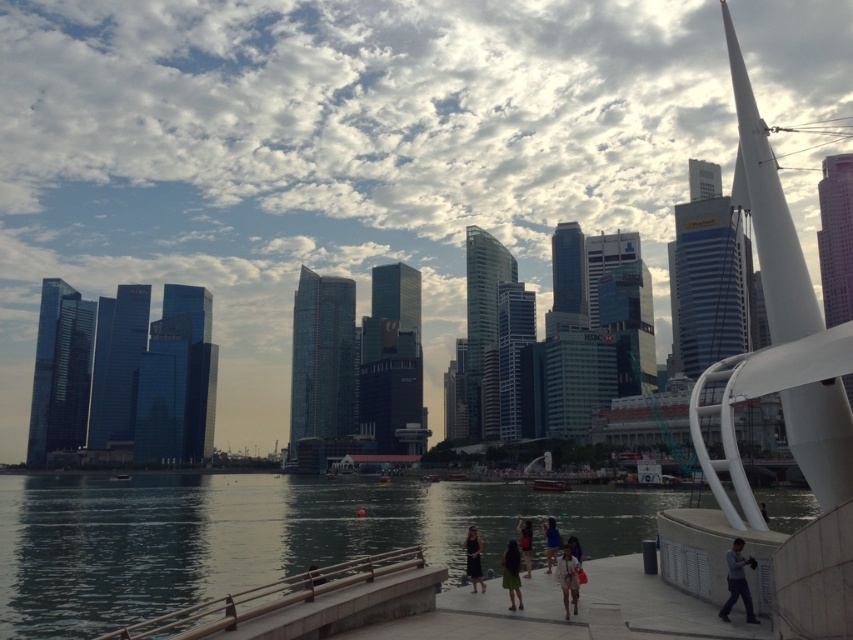
Does light beige fabric dress at center have a smaller size compared to matte black dress at center?

Yes.

I want to click on light beige fabric dress at center, so click(x=567, y=579).

Where is `light beige fabric dress at center`? light beige fabric dress at center is located at coordinates (567, 579).

Does dark blue water at lower center have a larger size compared to matte black dress at center?

Correct, dark blue water at lower center is larger in size than matte black dress at center.

In the scene shown: Which of these two, dark blue water at lower center or matte black dress at center, stands taller?

dark blue water at lower center

Locate an element on the screen. The width and height of the screenshot is (853, 640). dark blue water at lower center is located at coordinates (254, 536).

Between point (729, 577) and point (514, 573), which one is positioned behind?

Positioned behind is point (514, 573).

Who is taller, gray fabric jacket at lower right or green fabric skirt at center?

gray fabric jacket at lower right is taller.

Who is more forward, (740, 547) or (517, 566)?

Positioned in front is point (740, 547).

You are a GUI agent. You are given a task and a screenshot of the screen. Output one action in this format:
    pyautogui.click(x=<x>, y=<y>)
    Task: Click on the gray fabric jacket at lower right
    This screenshot has height=640, width=853.
    Given the screenshot: What is the action you would take?
    pyautogui.click(x=737, y=580)